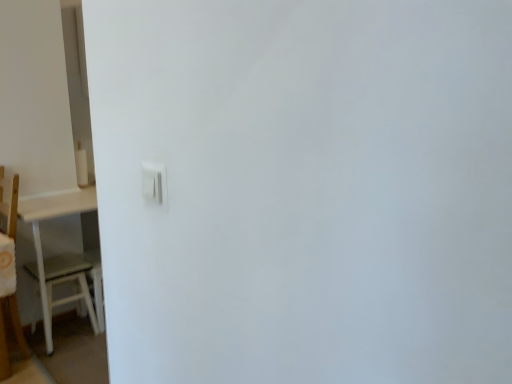
Question: Considering the relative positions of white plastic light switch at center and white wooden table at left in the image provided, is white plastic light switch at center to the right of white wooden table at left from the viewer's perspective?

Choices:
 (A) no
 (B) yes

Answer: (B)

Question: Is white plastic light switch at center bigger than white wooden table at left?

Choices:
 (A) yes
 (B) no

Answer: (B)

Question: Does white plastic light switch at center have a greater width compared to white wooden table at left?

Choices:
 (A) yes
 (B) no

Answer: (B)

Question: Can you confirm if white plastic light switch at center is shorter than white wooden table at left?

Choices:
 (A) no
 (B) yes

Answer: (B)

Question: From a real-world perspective, is white plastic light switch at center positioned over white wooden table at left based on gravity?

Choices:
 (A) no
 (B) yes

Answer: (B)

Question: Is point (40, 296) positioned closer to the camera than point (151, 173)?

Choices:
 (A) closer
 (B) farther

Answer: (B)

Question: From the image's perspective, is white matte table at left positioned above or below white plastic light switch at center?

Choices:
 (A) above
 (B) below

Answer: (B)

Question: Do you think white matte table at left is within white plastic light switch at center, or outside of it?

Choices:
 (A) inside
 (B) outside

Answer: (B)

Question: Is white matte table at left in front of or behind white plastic light switch at center in the image?

Choices:
 (A) front
 (B) behind

Answer: (B)

Question: From a real-world perspective, is white plastic light switch at center physically located above or below white wooden table at left?

Choices:
 (A) below
 (B) above

Answer: (B)

Question: In terms of size, does white plastic light switch at center appear bigger or smaller than white wooden table at left?

Choices:
 (A) big
 (B) small

Answer: (B)

Question: Is white plastic light switch at center to the left or to the right of white wooden table at left in the image?

Choices:
 (A) right
 (B) left

Answer: (A)

Question: In the image, is white plastic light switch at center positioned in front of or behind white wooden table at left?

Choices:
 (A) behind
 (B) front

Answer: (B)

Question: Considering the positions of point (4, 302) and point (147, 170), is point (4, 302) closer or farther from the camera than point (147, 170)?

Choices:
 (A) farther
 (B) closer

Answer: (A)

Question: From the image's perspective, relative to white plastic light switch at center, is white wooden table at left above or below?

Choices:
 (A) below
 (B) above

Answer: (A)